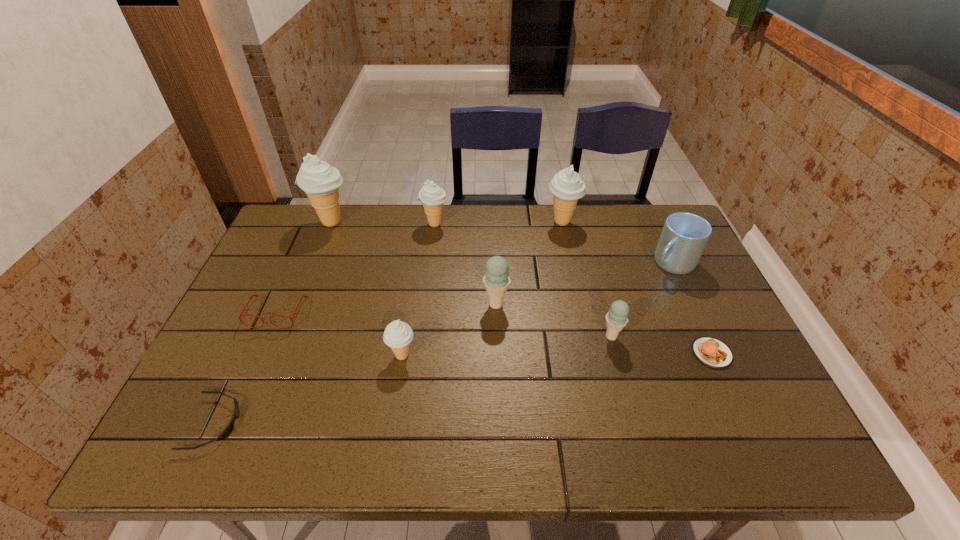
The width and height of the screenshot is (960, 540). I want to click on free space at the far left corner of the desktop, so (279, 230).

Where is `vacant space at the near right corner of the desktop`? vacant space at the near right corner of the desktop is located at coordinates (739, 423).

Image resolution: width=960 pixels, height=540 pixels. I want to click on vacant space that is in between the leftmost beige icecream and the ninth tallest object, so click(x=521, y=288).

Find the location of a particular element. The image size is (960, 540). free space between the right blue ice cream and the fifth shortest icecream is located at coordinates (587, 279).

This screenshot has height=540, width=960. In order to click on free space between the biggest beige icecream and the nearest beige icecream in this screenshot , I will do `click(367, 289)`.

What are the coordinates of `vacant point located between the patty and the spectacles` in the screenshot? It's located at (494, 333).

Find the location of `free space between the third shortest object and the fourth farthest object`. free space between the third shortest object and the fourth farthest object is located at coordinates (474, 287).

Find the location of `empty space between the rightmost beige icecream and the farther blue ice cream`. empty space between the rightmost beige icecream and the farther blue ice cream is located at coordinates (529, 263).

Locate an element on the screen. Image resolution: width=960 pixels, height=540 pixels. empty location between the mug and the fourth farthest icecream is located at coordinates (584, 284).

The width and height of the screenshot is (960, 540). Identify the location of vacant point located between the second tallest object and the nearer blue ice cream. (587, 279).